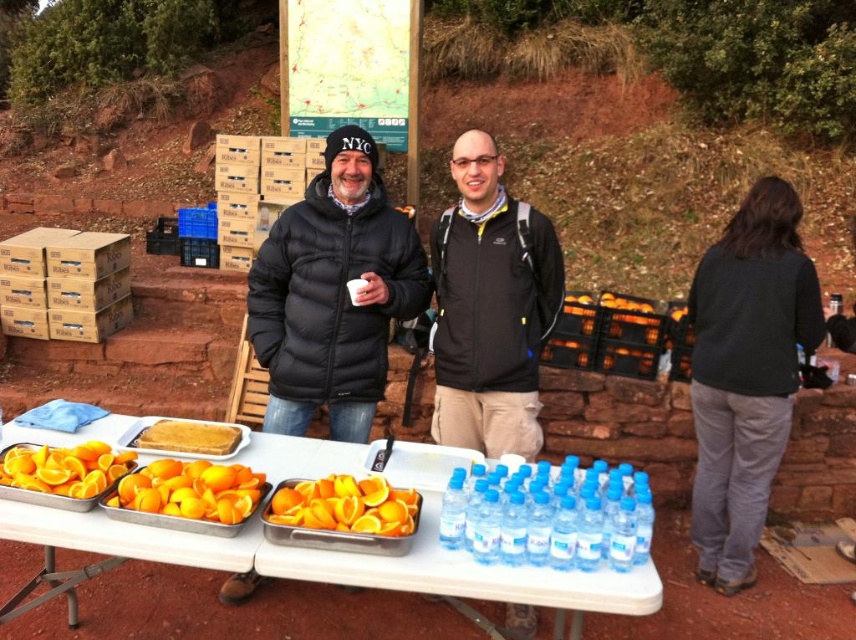
Question: Which of the following is the closest to the observer?

Choices:
 (A) (773, 358)
 (B) (627, 552)
 (C) (444, 518)

Answer: (B)

Question: Which object appears closest to the camera in this image?

Choices:
 (A) white plastic table at center
 (B) golden crumbly pie at center
 (C) clear plastic bottles at center

Answer: (A)

Question: Which point is farther to the camera?

Choices:
 (A) white plastic table at center
 (B) black puffer jacket at center
 (C) black matte jacket at center

Answer: (C)

Question: Does golden crumbly pie at center have a smaller size compared to clear plastic water bottle at center?

Choices:
 (A) no
 (B) yes

Answer: (A)

Question: Is clear plastic bottles at center closer to the viewer compared to clear plastic bottle at center?

Choices:
 (A) no
 (B) yes

Answer: (B)

Question: Observing the image, what is the correct spatial positioning of clear plastic bottles at center in reference to golden crumbly pie at center?

Choices:
 (A) left
 (B) right

Answer: (B)